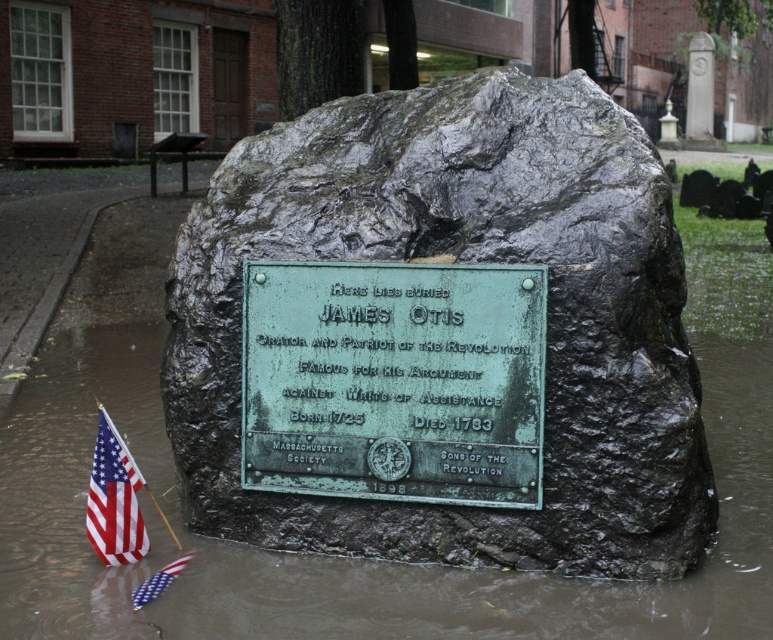
Which is more to the right, green patina stone boulder at center or green patina plaque at center?

green patina stone boulder at center is more to the right.

Which is more to the left, green patina stone boulder at center or green patina plaque at center?

green patina plaque at center is more to the left.

Is point (617, 150) in front of point (523, 298)?

No, (617, 150) is further to viewer.

Identify the location of green patina stone boulder at center. Image resolution: width=773 pixels, height=640 pixels. (477, 259).

Does point (494, 324) lie in front of point (135, 595)?

Yes, it is.

Does green patina plaque at center have a lesser width compared to american flag fabric at lower left?

No, green patina plaque at center is not thinner than american flag fabric at lower left.

Is point (359, 353) in front of point (152, 598)?

Yes, it is.

The height and width of the screenshot is (640, 773). I want to click on green patina plaque at center, so click(x=394, y=380).

Is green patina stone boulder at center smaller than american flag fabric at lower left?

No.

Which is above, green patina stone boulder at center or american flag fabric at lower left?

Positioned higher is green patina stone boulder at center.

Does point (243, 147) come behind point (141, 592)?

Yes, point (243, 147) is farther from viewer.

Find the location of a particular element. green patina stone boulder at center is located at coordinates (477, 259).